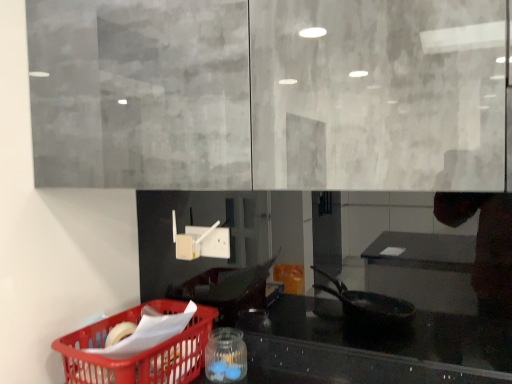
This screenshot has width=512, height=384. What are the coordinates of `matte plastic basket at lower left` in the screenshot? It's located at (137, 354).

Describe the element at coordinates (137, 354) in the screenshot. The image size is (512, 384). I see `matte plastic basket at lower left` at that location.

Image resolution: width=512 pixels, height=384 pixels. Describe the element at coordinates (225, 356) in the screenshot. I see `transparent glass jar at lower center` at that location.

You are a GUI agent. You are given a task and a screenshot of the screen. Output one action in this format:
    pyautogui.click(x=<x>, y=<y>)
    Task: Click on the transparent glass jar at lower center
    This screenshot has width=512, height=384.
    Given the screenshot: What is the action you would take?
    pyautogui.click(x=225, y=356)

In order to click on matte plastic basket at lower left in this screenshot , I will do `click(137, 354)`.

Based on their positions, is transparent glass jar at lower center located to the left or right of matte plastic basket at lower left?

Based on their positions, transparent glass jar at lower center is located to the right of matte plastic basket at lower left.

Which object is closer to the camera, transparent glass jar at lower center or matte plastic basket at lower left?

Positioned in front is matte plastic basket at lower left.

Which is closer, (217, 330) or (164, 354)?

Clearly, point (217, 330) is more distant from the camera than point (164, 354).

From the image's perspective, which is below, transparent glass jar at lower center or matte plastic basket at lower left?

From the image's view, matte plastic basket at lower left is below.

In the scene shown: From a real-world perspective, is transparent glass jar at lower center positioned above or below matte plastic basket at lower left?

In terms of real-world spatial position, transparent glass jar at lower center is below matte plastic basket at lower left.

Is transparent glass jar at lower center wider or thinner than matte plastic basket at lower left?

Considering their sizes, transparent glass jar at lower center looks slimmer than matte plastic basket at lower left.

Between transparent glass jar at lower center and matte plastic basket at lower left, which one has less height?

Standing shorter between the two is transparent glass jar at lower center.

Who is bigger, transparent glass jar at lower center or matte plastic basket at lower left?

matte plastic basket at lower left.

Is transparent glass jar at lower center situated inside matte plastic basket at lower left or outside?

transparent glass jar at lower center is spatially situated outside matte plastic basket at lower left.

Is transparent glass jar at lower center not close to matte plastic basket at lower left?

No, transparent glass jar at lower center is in close proximity to matte plastic basket at lower left.

Is transparent glass jar at lower center facing towards matte plastic basket at lower left?

No, transparent glass jar at lower center is not oriented towards matte plastic basket at lower left.

How many degrees apart are the facing directions of transparent glass jar at lower center and matte plastic basket at lower left?

The angle between the facing direction of transparent glass jar at lower center and the facing direction of matte plastic basket at lower left is 0.00054 degrees.

This screenshot has height=384, width=512. In order to click on basket in front of the transparent glass jar at lower center in this screenshot , I will do `click(137, 354)`.

Visually, is matte plastic basket at lower left positioned to the left or to the right of transparent glass jar at lower center?

matte plastic basket at lower left is to the left of transparent glass jar at lower center.

Which object is further away from the camera, matte plastic basket at lower left or transparent glass jar at lower center?

transparent glass jar at lower center.

Which point is more forward, (81, 360) or (214, 358)?

The point (81, 360) is closer.

From the image's perspective, between matte plastic basket at lower left and transparent glass jar at lower center, who is located below?

From the image's view, matte plastic basket at lower left is below.

From a real-world perspective, relative to transparent glass jar at lower center, is matte plastic basket at lower left vertically above or below?

matte plastic basket at lower left is situated higher than transparent glass jar at lower center in the real world.

From the picture: Is matte plastic basket at lower left wider or thinner than transparent glass jar at lower center?

In the image, matte plastic basket at lower left appears to be wider than transparent glass jar at lower center.

Considering the relative sizes of matte plastic basket at lower left and transparent glass jar at lower center in the image provided, is matte plastic basket at lower left taller than transparent glass jar at lower center?

Indeed, matte plastic basket at lower left has a greater height compared to transparent glass jar at lower center.

Is matte plastic basket at lower left smaller than transparent glass jar at lower center?

Actually, matte plastic basket at lower left might be larger than transparent glass jar at lower center.

Is matte plastic basket at lower left inside or outside of transparent glass jar at lower center?

matte plastic basket at lower left is not inside transparent glass jar at lower center, it's outside.

Is matte plastic basket at lower left positioned far away from transparent glass jar at lower center?

No, matte plastic basket at lower left is not far from transparent glass jar at lower center.

Is matte plastic basket at lower left aimed at transparent glass jar at lower center?

No, matte plastic basket at lower left does not turn towards transparent glass jar at lower center.

What's the angular difference between matte plastic basket at lower left and transparent glass jar at lower center's facing directions?

The angular difference between matte plastic basket at lower left and transparent glass jar at lower center is 0.00054 degrees.

In order to click on basket below the transparent glass jar at lower center (from the image's perspective) in this screenshot , I will do `click(137, 354)`.

Where is `glass jar behind the matte plastic basket at lower left`? Image resolution: width=512 pixels, height=384 pixels. glass jar behind the matte plastic basket at lower left is located at coordinates (225, 356).

At what (x,y) coordinates should I click in order to perform the action: click on glass jar located above the matte plastic basket at lower left (from the image's perspective). Please return your answer as a coordinate pair (x, y). This screenshot has height=384, width=512. Looking at the image, I should click on (225, 356).